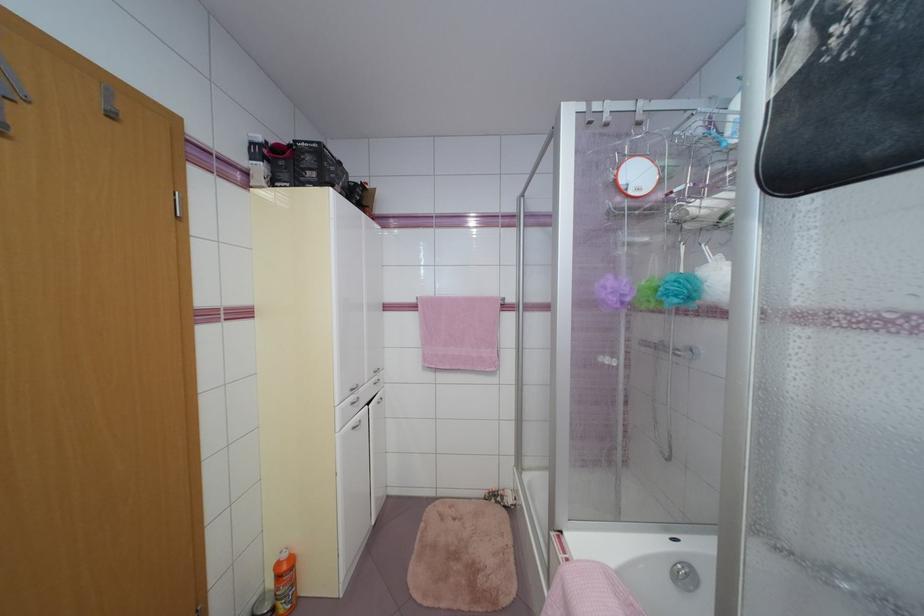
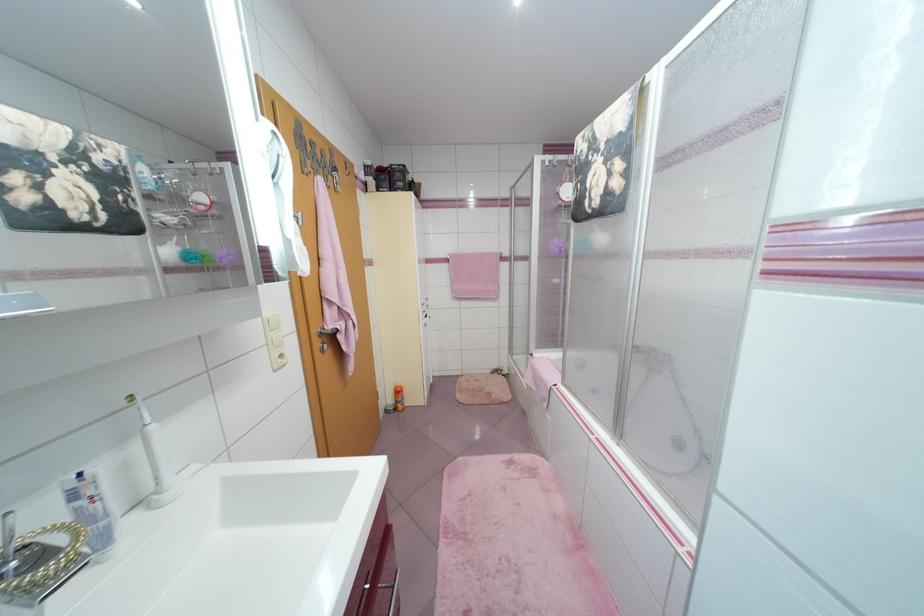
Question: What movement of the cameraman would produce the second image?

Choices:
 (A) Left
 (B) Right
 (C) Forward
 (D) Backward

Answer: (D)